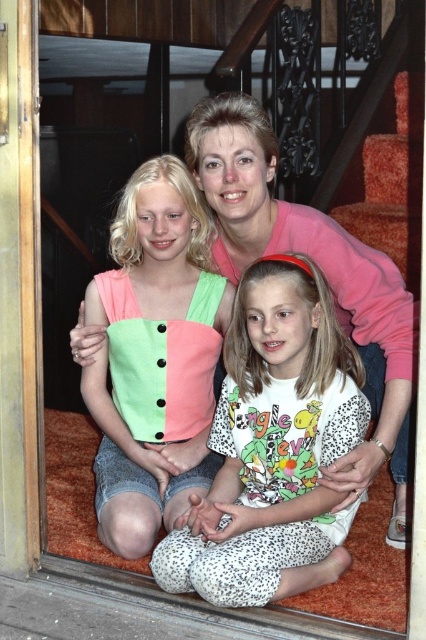
Question: Can you confirm if white leopard print pajama pants at center is positioned above matte cotton tank top at center?

Choices:
 (A) yes
 (B) no

Answer: (B)

Question: Among these points, which one is farthest from the camera?

Choices:
 (A) (154, 168)
 (B) (252, 561)

Answer: (A)

Question: Among these objects, which one is nearest to the camera?

Choices:
 (A) matte cotton tank top at center
 (B) white leopard print pajama pants at center

Answer: (B)

Question: In this image, where is white leopard print pajama pants at center located relative to matte cotton tank top at center?

Choices:
 (A) above
 (B) below

Answer: (B)

Question: Is white leopard print pajama pants at center bigger than matte cotton tank top at center?

Choices:
 (A) yes
 (B) no

Answer: (A)